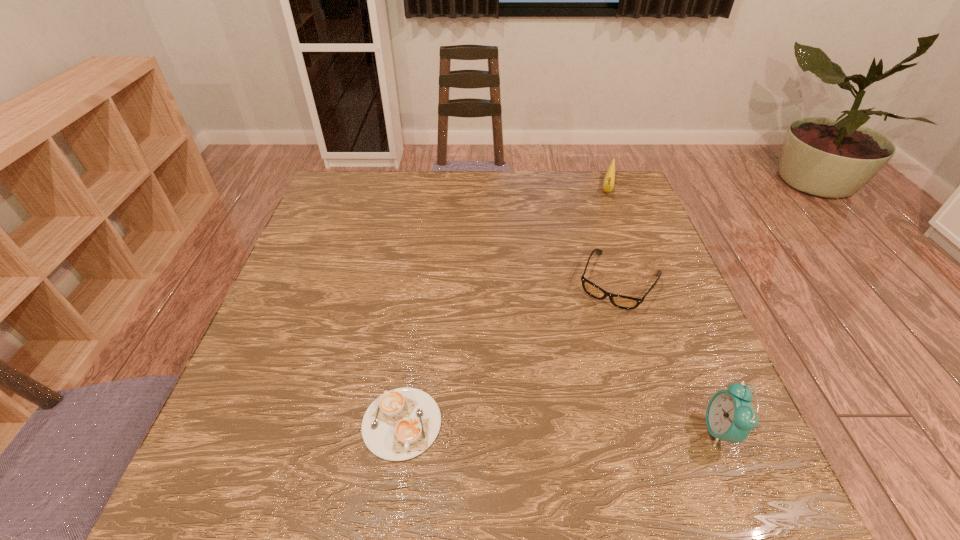
Where is `vacant area located 0.110m on the face of the tallest object`? The image size is (960, 540). vacant area located 0.110m on the face of the tallest object is located at coordinates (642, 430).

The width and height of the screenshot is (960, 540). What are the coordinates of `free region located 0.070m on the front-facing side of the spectacles` in the screenshot? It's located at (593, 331).

This screenshot has width=960, height=540. In order to click on free space located 0.160m on the front-facing side of the spectacles in this screenshot , I will do `click(578, 360)`.

Where is `vacant space located on the front-facing side of the spectacles`? The height and width of the screenshot is (540, 960). vacant space located on the front-facing side of the spectacles is located at coordinates (576, 363).

Identify the location of vacant space located at the stem of the farthest object. The height and width of the screenshot is (540, 960). (594, 284).

The height and width of the screenshot is (540, 960). I want to click on vacant space located 0.390m at the stem of the farthest object, so click(x=593, y=292).

Locate an element on the screen. vacant region located at the stem of the farthest object is located at coordinates (601, 251).

Locate an element on the screen. object that is positioned at the far edge is located at coordinates (609, 180).

The image size is (960, 540). I want to click on cappuccino that is at the near edge, so click(402, 423).

Locate an element on the screen. This screenshot has width=960, height=540. alarm clock that is positioned at the near edge is located at coordinates (730, 417).